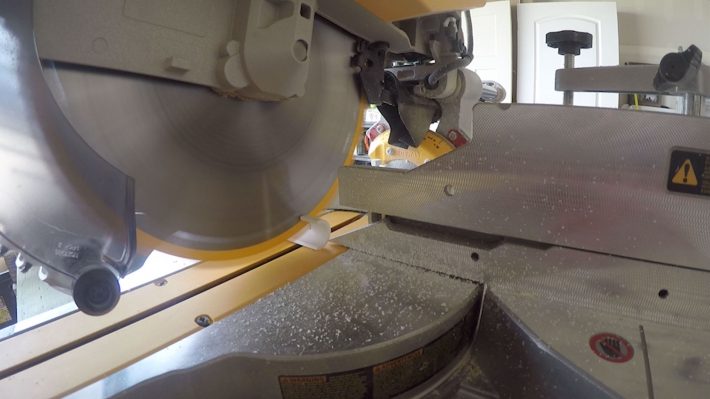
This screenshot has height=399, width=710. Identify the location of knot in wood. (202, 315), (158, 281).